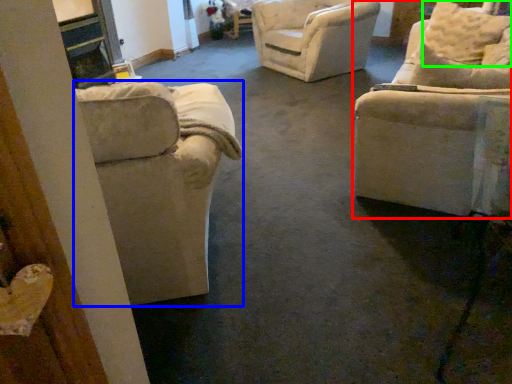
Question: Which object is the closest to the chair (highlighted by a red box)? Choose among these: chair (highlighted by a blue box) or pillow (highlighted by a green box).

Choices:
 (A) chair
 (B) pillow

Answer: (A)